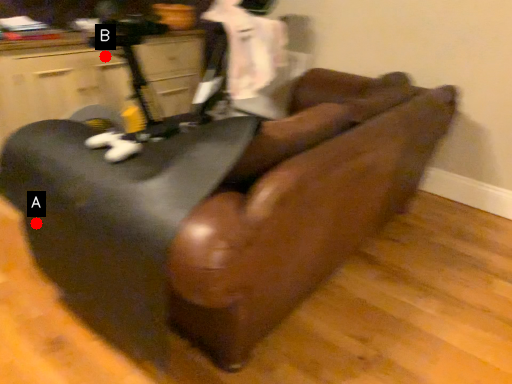
Question: Two points are circled on the image, labeled by A and B beside each circle. Which of the following is the farthest from the observer?

Choices:
 (A) A is further
 (B) B is further

Answer: (B)